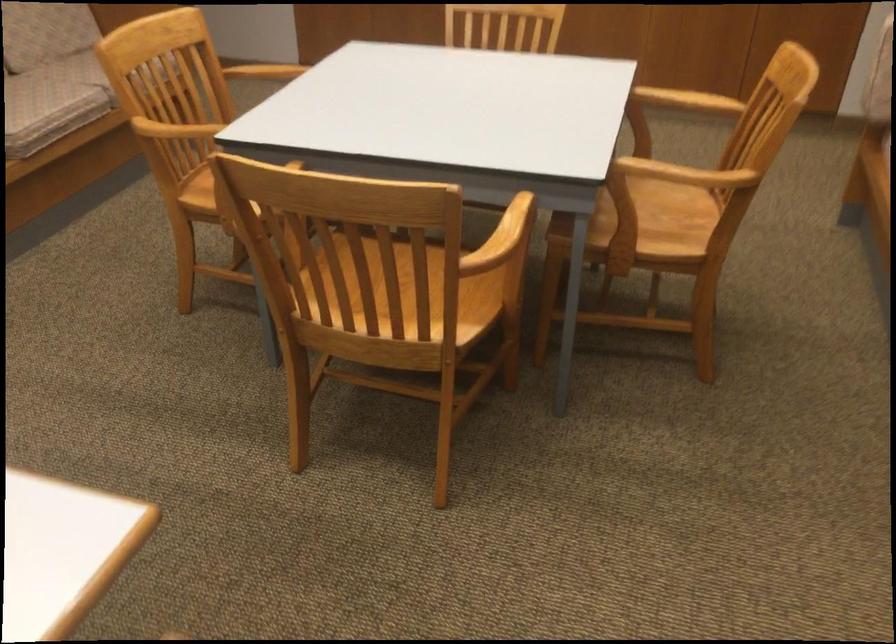
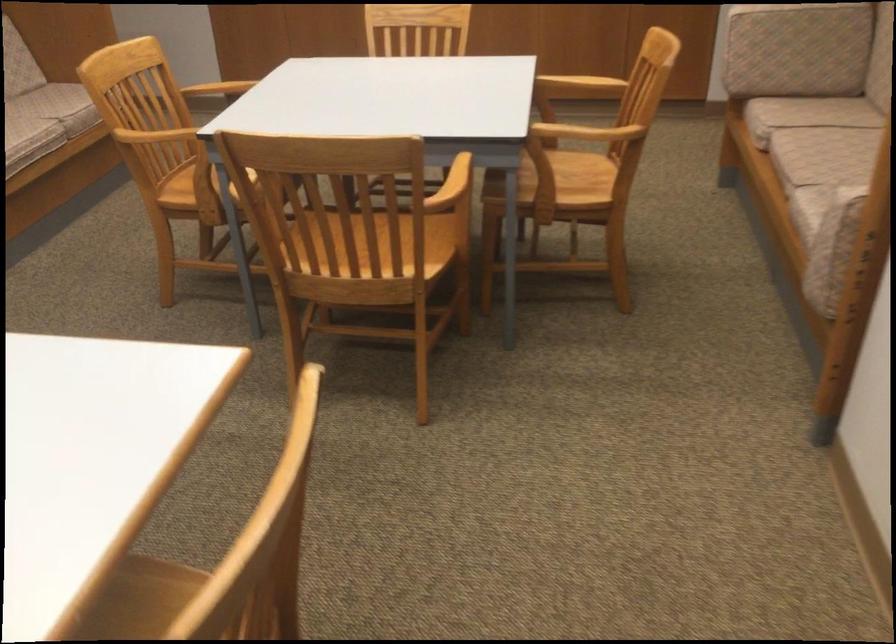
In the second image, find the point that corresponds to [641,230] in the first image.

(556, 182)